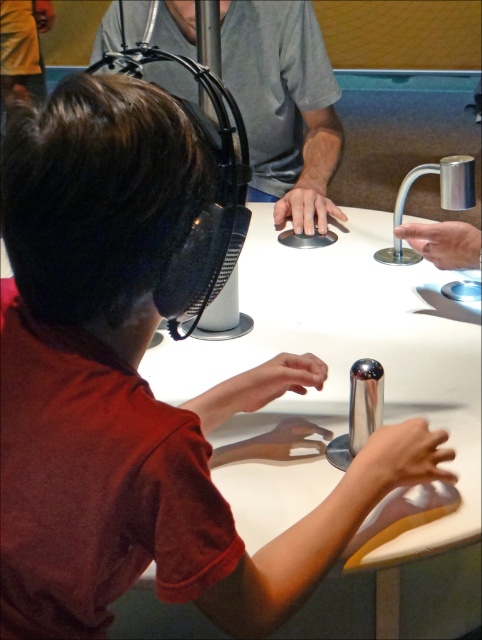
Who is more forward, (x=374, y=492) or (x=309, y=221)?

Positioned in front is point (x=374, y=492).

At what (x,y) coordinates should I click in order to perform the action: click on smooth silver faucet at lower center. Please return your answer as a coordinate pair (x, y). Image resolution: width=482 pixels, height=640 pixels. Looking at the image, I should click on (397, 461).

Does matte black headset at upper center have a smaller size compared to metallic silver faucet at right?

No, matte black headset at upper center is not smaller than metallic silver faucet at right.

Is point (237, 77) closer to viewer compared to point (436, 227)?

That is False.

Locate an element on the screen. This screenshot has height=640, width=482. matte black headset at upper center is located at coordinates (283, 106).

Which of these two, smooth silver faucet at lower center or silver metallic faucet at center right, stands taller?

With more height is silver metallic faucet at center right.

Who is more distant from viewer, [350,480] or [442,204]?

The point [442,204] is more distant.

Between point (418, 432) and point (450, 164), which one is positioned behind?

Point (450, 164)

Locate an element on the screen. smooth silver faucet at lower center is located at coordinates (397, 461).